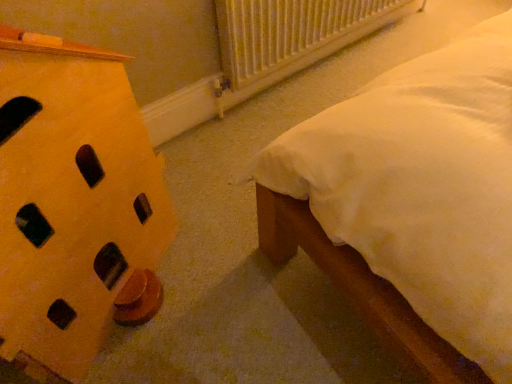
The width and height of the screenshot is (512, 384). I want to click on vacant area that is situated to the right of yellow matte wooden block at left, so click(x=233, y=283).